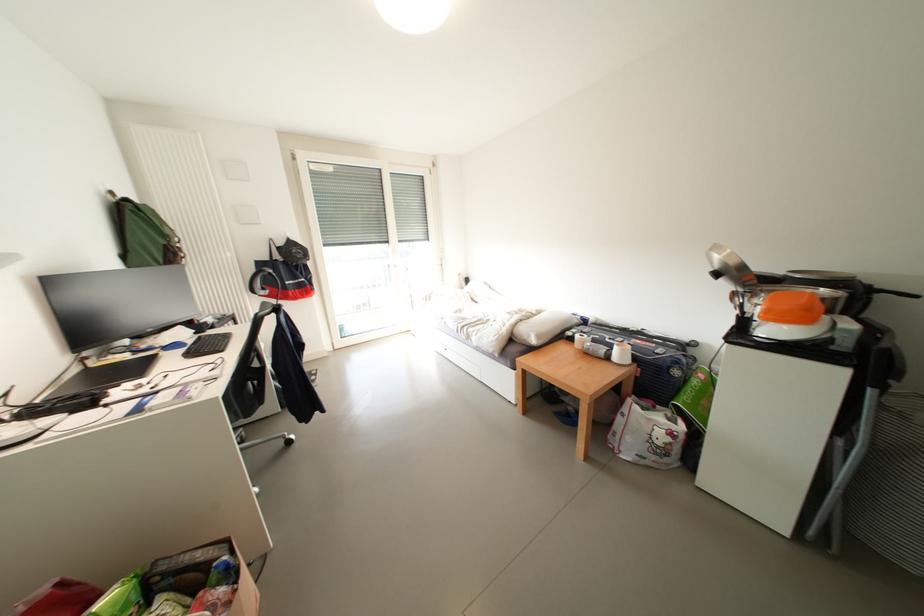
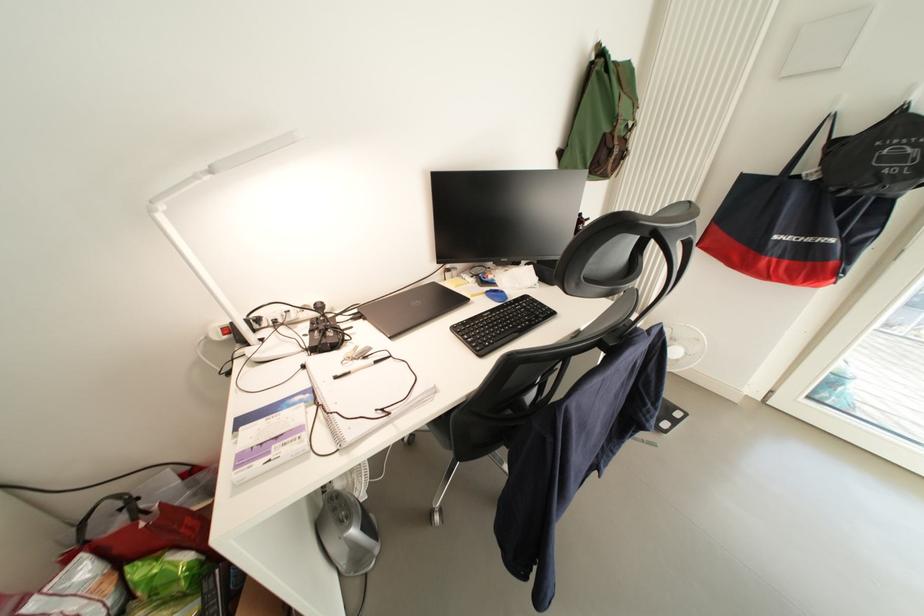
Where in the second image is the point corresponding to point (131, 259) from the first image?

(568, 156)